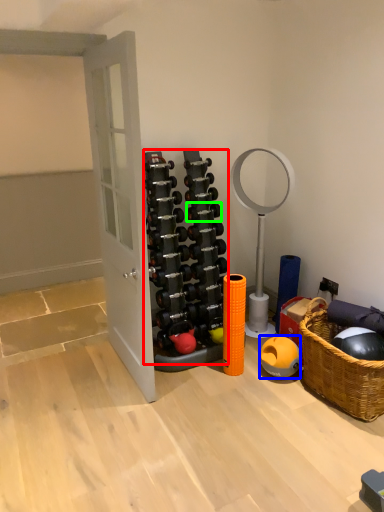
Question: Estimate the real-world distances between objects in this image. Which object is farther from dumbbell (highlighted by a red box), dumbbell (highlighted by a blue box) or dumbbell (highlighted by a green box)?

Choices:
 (A) dumbbell
 (B) dumbbell

Answer: (A)